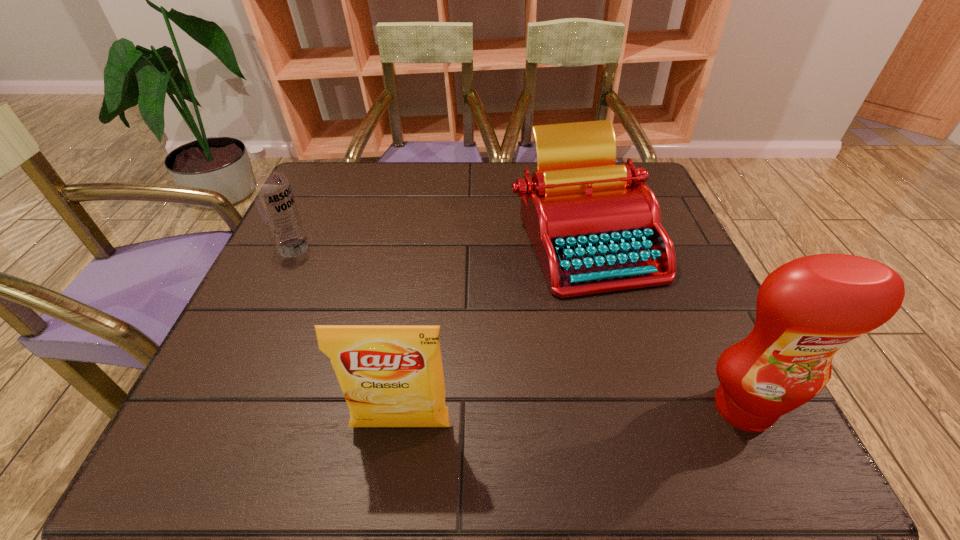
This screenshot has height=540, width=960. In order to click on object that stands as the second closest to the leftmost object in this screenshot , I will do `click(595, 227)`.

At what (x,y) coordinates should I click in order to perform the action: click on the closest object to the second object from left to right. Please return your answer as a coordinate pair (x, y). Looking at the image, I should click on (595, 227).